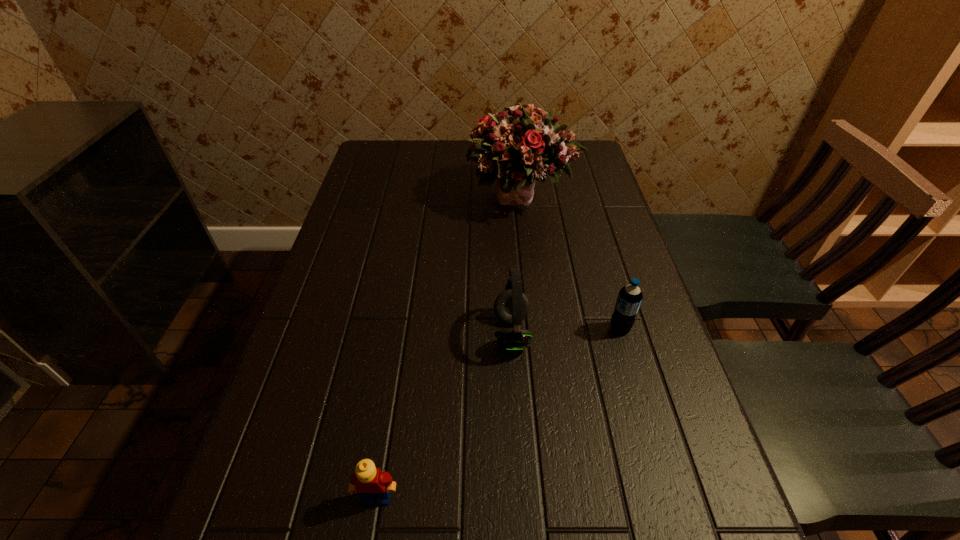
Identify which object is the second nearest to the Lego. Please provide its 2D coordinates. Your answer should be formatted as a tuple, i.e. [(x, y)], where the tuple contains the x and y coordinates of a point satisfying the conditions above.

[(629, 299)]

Where is `blank area in the image that satisfies the following two spatial constraints: 1. on the ear cups of the headset; 2. on the front-facing side of the shortest object`? blank area in the image that satisfies the following two spatial constraints: 1. on the ear cups of the headset; 2. on the front-facing side of the shortest object is located at coordinates (522, 497).